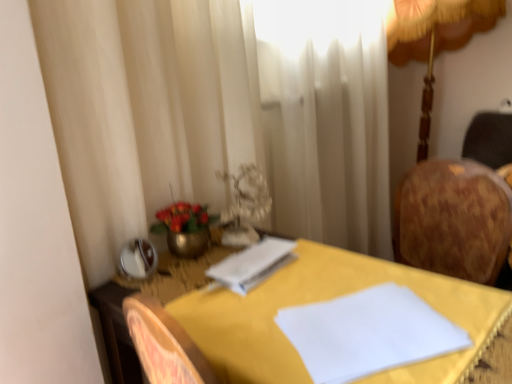
Question: From the image's perspective, is white paper at center on top of gold fabric lampshade at upper right?

Choices:
 (A) no
 (B) yes

Answer: (A)

Question: Does white paper at center appear on the left side of gold fabric lampshade at upper right?

Choices:
 (A) yes
 (B) no

Answer: (A)

Question: Considering the relative sizes of white paper at center and gold fabric lampshade at upper right in the image provided, is white paper at center thinner than gold fabric lampshade at upper right?

Choices:
 (A) yes
 (B) no

Answer: (A)

Question: Is white paper at center next to gold fabric lampshade at upper right and touching it?

Choices:
 (A) no
 (B) yes

Answer: (A)

Question: Are white paper at center and gold fabric lampshade at upper right far apart?

Choices:
 (A) no
 (B) yes

Answer: (B)

Question: Is white paper at center looking in the opposite direction of gold fabric lampshade at upper right?

Choices:
 (A) no
 (B) yes

Answer: (A)

Question: Does metallic gold vase at center come behind gold fabric lampshade at upper right?

Choices:
 (A) yes
 (B) no

Answer: (B)

Question: Is metallic gold vase at center at the left side of gold fabric lampshade at upper right?

Choices:
 (A) no
 (B) yes

Answer: (B)

Question: Does metallic gold vase at center lie in front of gold fabric lampshade at upper right?

Choices:
 (A) no
 (B) yes

Answer: (B)

Question: Considering the relative sizes of metallic gold vase at center and gold fabric lampshade at upper right in the image provided, is metallic gold vase at center taller than gold fabric lampshade at upper right?

Choices:
 (A) yes
 (B) no

Answer: (B)

Question: Can you confirm if metallic gold vase at center is bigger than gold fabric lampshade at upper right?

Choices:
 (A) yes
 (B) no

Answer: (B)

Question: Can you confirm if metallic gold vase at center is thinner than gold fabric lampshade at upper right?

Choices:
 (A) yes
 (B) no

Answer: (A)

Question: From the image's perspective, is yellow fabric-covered table at center beneath white paper at center?

Choices:
 (A) yes
 (B) no

Answer: (A)